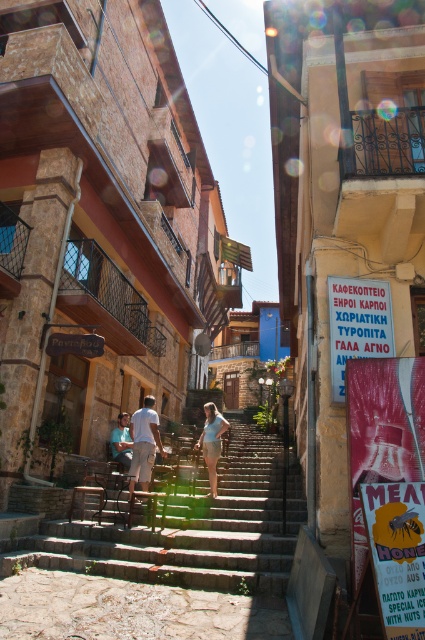
Question: Which of the following is the farthest from the observer?

Choices:
 (A) (62, 564)
 (B) (119, 452)
 (C) (198, 440)
 (D) (144, 429)

Answer: (C)

Question: Among these points, which one is farthest from the camera?

Choices:
 (A) (139, 436)
 (B) (127, 436)
 (C) (34, 540)

Answer: (B)

Question: Is stone stairs at center further to the viewer compared to light blue shirt at center?

Choices:
 (A) yes
 (B) no

Answer: (B)

Question: Can you confirm if stone stairs at center is smaller than light brown shorts at center?

Choices:
 (A) no
 (B) yes

Answer: (B)

Question: Which of the following is the farthest from the observer?

Choices:
 (A) stone stairs at center
 (B) light brown shorts at center
 (C) light blue shirt at center
 (D) light blue denim shorts at center

Answer: (C)

Question: Is stone stairs at center positioned at the back of light blue denim shorts at center?

Choices:
 (A) yes
 (B) no

Answer: (B)